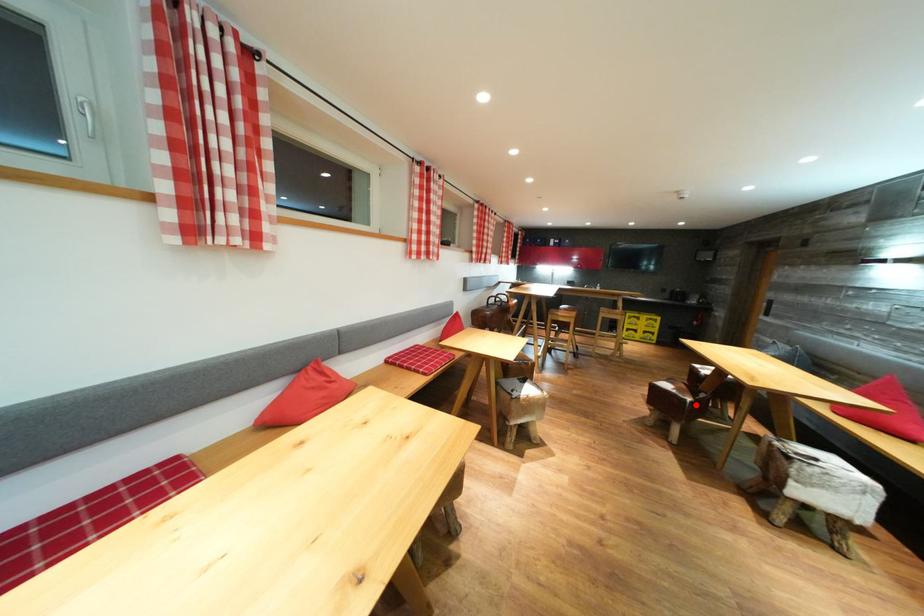
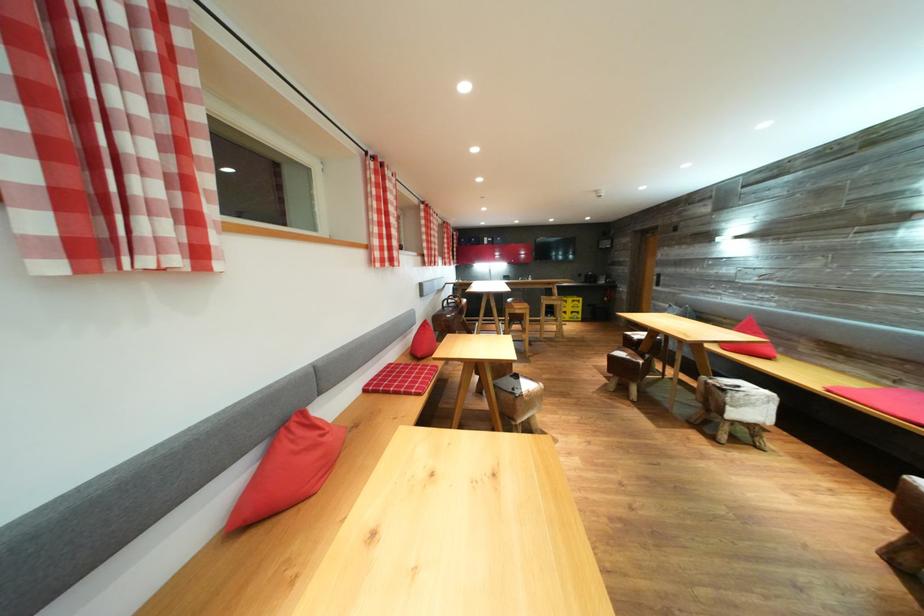
Question: I am providing you with two images of the same scene from different viewpoints. A red point is marked on the first image. Is the red point's position out of view in image 2?

Choices:
 (A) Yes
 (B) No

Answer: (B)